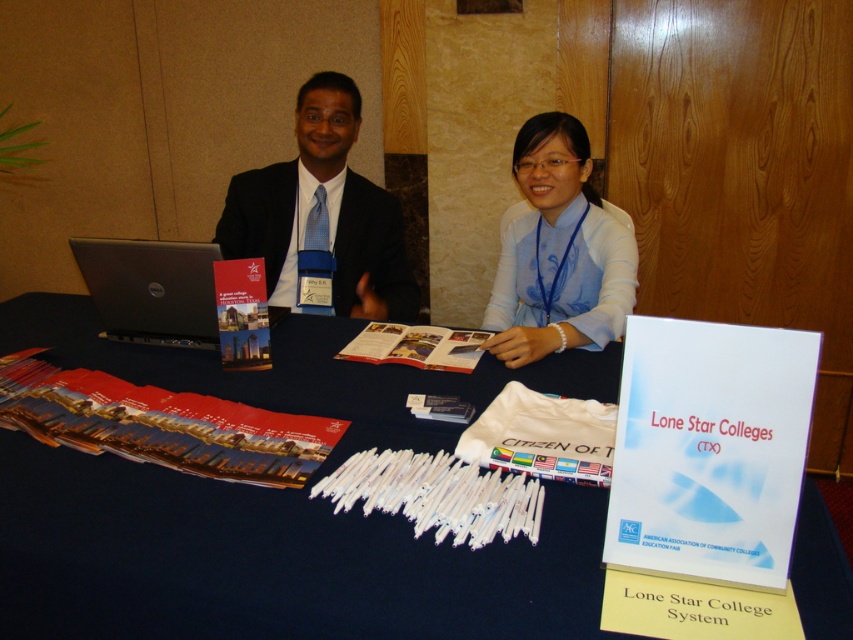
You are a photographer at the event and need to ensure both the matte black suit at center and the blue silk blouse at center are in focus. Given that your camera has a depth of field that can cover 20 inches, will both items be in focus?

The matte black suit at center and blue silk blouse at center are 21.34 inches apart from each other. Since the distance between them exceeds the camera depth of field of 20 inches, they will not both be in focus simultaneously.

You are a student attending a college fair and need to locate two specific points marked on the table. The first point is at coordinates point (x=354, y=237) and the second is at point (x=515, y=353). From your perspective standing at the front of the table, which point is closer to you?

Point (x=515, y=353) is closer to you because it is in front of point (x=354, y=237).

Looking at this image, you are attending a career fair and see two people sitting at a table. They are wearing a matte black suit at center and a blue silk blouse at center. If you were standing directly in front of the table, which clothing item would be on your left?

The matte black suit at center is to the left of the blue silk blouse at center, so when standing in front of the table, the matte black suit at center would be on your left.